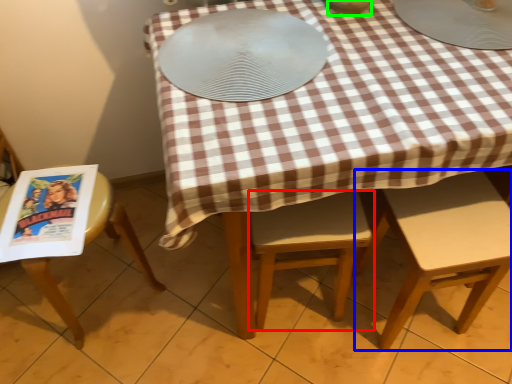
Question: Which object is the closest to the chair (highlighted by a red box)? Choose among these: chair (highlighted by a blue box) or tableware (highlighted by a green box).

Choices:
 (A) chair
 (B) tableware

Answer: (A)